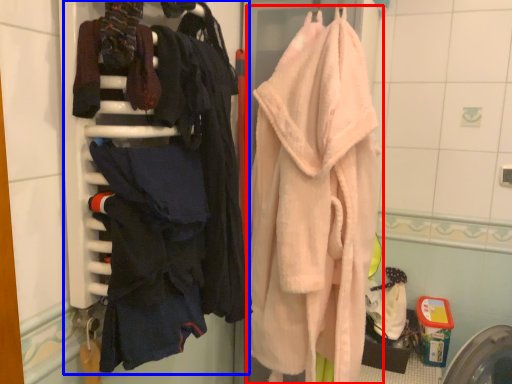
Question: Which point is further to the camera, towel (highlighted by a red box) or closet (highlighted by a blue box)?

Choices:
 (A) towel
 (B) closet

Answer: (A)